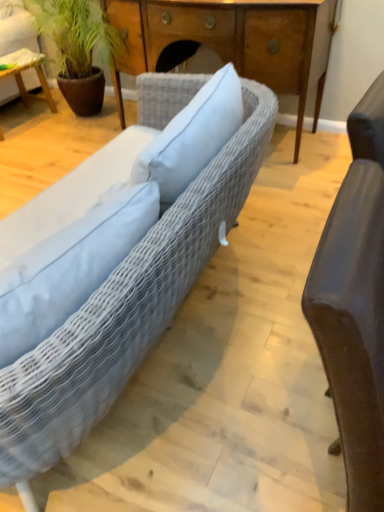
Describe the element at coordinates (75, 35) in the screenshot. The height and width of the screenshot is (512, 384). I see `green leafy plant at upper left` at that location.

Identify the location of wooden table at left. This screenshot has height=512, width=384. (24, 70).

Describe the element at coordinates (355, 305) in the screenshot. The height and width of the screenshot is (512, 384). I see `matte brown leather chair at right` at that location.

From the picture: Measure the distance between point (365,424) and camera.

Point (365,424) is 23.78 inches away from camera.

This screenshot has height=512, width=384. Identify the location of woven fabric couch at center. (126, 309).

Is point (383, 391) positioned after point (88, 314)?

No, it is in front of (88, 314).

Visually, is matte brown leather chair at right positioned to the left or to the right of woven fabric couch at center?

In the image, matte brown leather chair at right appears on the right side of woven fabric couch at center.

From the picture: Considering the relative positions of matte brown leather chair at right and woven fabric couch at center in the image provided, is matte brown leather chair at right in front of woven fabric couch at center?

Yes, the depth of matte brown leather chair at right is less than that of woven fabric couch at center.

Between woven fabric couch at center and wooden desk at center, which one has more height?

With more height is wooden desk at center.

Find the location of `desk above the woven fabric couch at center (from a real-world perspective)`. desk above the woven fabric couch at center (from a real-world perspective) is located at coordinates (233, 41).

From a real-world perspective, who is located higher, woven fabric couch at center or wooden desk at center?

From a 3D spatial view, wooden desk at center is above.

From the image's perspective, is woven fabric couch at center under wooden desk at center?

Yes, from the image's perspective, woven fabric couch at center is beneath wooden desk at center.

Which of these two, woven fabric couch at center or wooden table at left, is wider?

With larger width is woven fabric couch at center.

From a real-world perspective, is woven fabric couch at center positioned above or below wooden table at left?

woven fabric couch at center is situated lower than wooden table at left in the real world.

In the scene shown: Is woven fabric couch at center aimed at wooden table at left?

No, woven fabric couch at center is not facing towards wooden table at left.

Between matte brown leather chair at right and wooden desk at center, which one has more height?

Standing taller between the two is matte brown leather chair at right.

From the image's perspective, who appears lower, matte brown leather chair at right or wooden desk at center?

matte brown leather chair at right.

Looking at this image, considering their positions, is matte brown leather chair at right located in front of or behind wooden desk at center?

matte brown leather chair at right is positioned closer to the viewer than wooden desk at center.

Considering the sizes of matte brown leather chair at right and wooden desk at center in the image, is matte brown leather chair at right bigger or smaller than wooden desk at center?

Considering their sizes, matte brown leather chair at right takes up less space than wooden desk at center.

Can you tell me how much wooden table at left and woven fabric couch at center differ in facing direction?

The angular difference between wooden table at left and woven fabric couch at center is 174 degrees.

Considering the sizes of objects wooden table at left and woven fabric couch at center in the image provided, who is taller, wooden table at left or woven fabric couch at center?

wooden table at left.

Does wooden table at left have a lesser width compared to woven fabric couch at center?

Indeed, wooden table at left has a lesser width compared to woven fabric couch at center.

Could you tell me if wooden table at left is turned towards woven fabric couch at center?

No, wooden table at left does not turn towards woven fabric couch at center.

In the image, is green leafy plant at upper left positioned in front of or behind matte brown leather chair at right?

Clearly, green leafy plant at upper left is behind matte brown leather chair at right.

Could you tell me if green leafy plant at upper left is turned towards matte brown leather chair at right?

No, green leafy plant at upper left is not oriented towards matte brown leather chair at right.

Is green leafy plant at upper left to the left of wooden table at left from the viewer's perspective?

No.

Considering the points (53, 13) and (19, 80), which point is behind, point (53, 13) or point (19, 80)?

The point (19, 80) is more distant.

Consider the image. Is green leafy plant at upper left facing away from wooden table at left?

green leafy plant at upper left does not have its back to wooden table at left.

From a real-world perspective, is green leafy plant at upper left located beneath wooden table at left?

No, from a real-world perspective, green leafy plant at upper left is not below wooden table at left.

Locate an element on the screen. The height and width of the screenshot is (512, 384). chair that appears in front of the woven fabric couch at center is located at coordinates (355, 305).

At what (x,y) coordinates should I click in order to perform the action: click on desk behind the woven fabric couch at center. Please return your answer as a coordinate pair (x, y). The width and height of the screenshot is (384, 512). Looking at the image, I should click on (233, 41).

Considering their positions, is wooden table at left positioned closer to green leafy plant at upper left than woven fabric couch at center?

Answer: wooden table at left is positioned closer to the anchor green leafy plant at upper left.

Based on their spatial positions, is wooden table at left or matte brown leather chair at right further from green leafy plant at upper left?

matte brown leather chair at right is further to green leafy plant at upper left.

When comparing their distances from wooden table at left, does matte brown leather chair at right or green leafy plant at upper left seem closer?

green leafy plant at upper left.

When comparing their distances from woven fabric couch at center, does matte brown leather chair at right or wooden desk at center seem closer?

matte brown leather chair at right is closer to woven fabric couch at center.

From the image, which object appears to be farther from wooden desk at center, wooden table at left or woven fabric couch at center?

woven fabric couch at center lies further to wooden desk at center than the other object.

From the image, which object appears to be nearer to wooden desk at center, woven fabric couch at center or matte brown leather chair at right?

Based on the image, woven fabric couch at center appears to be nearer to wooden desk at center.

From the image, which object appears to be nearer to wooden table at left, wooden desk at center or matte brown leather chair at right?

Based on the image, wooden desk at center appears to be nearer to wooden table at left.

Looking at the image, which one is located further to green leafy plant at upper left, matte brown leather chair at right or wooden table at left?

matte brown leather chair at right lies further to green leafy plant at upper left than the other object.

Where is `desk located between woven fabric couch at center and green leafy plant at upper left in the depth direction`? Image resolution: width=384 pixels, height=512 pixels. desk located between woven fabric couch at center and green leafy plant at upper left in the depth direction is located at coordinates (233, 41).

Locate an element on the screen. houseplant between wooden table at left and wooden desk at center from left to right is located at coordinates (75, 35).

At what (x,y) coordinates should I click in order to perform the action: click on houseplant positioned between matte brown leather chair at right and wooden table at left from near to far. Please return your answer as a coordinate pair (x, y). The image size is (384, 512). Looking at the image, I should click on (75, 35).

Where is `desk located between woven fabric couch at center and wooden table at left in the depth direction`? Image resolution: width=384 pixels, height=512 pixels. desk located between woven fabric couch at center and wooden table at left in the depth direction is located at coordinates (233, 41).